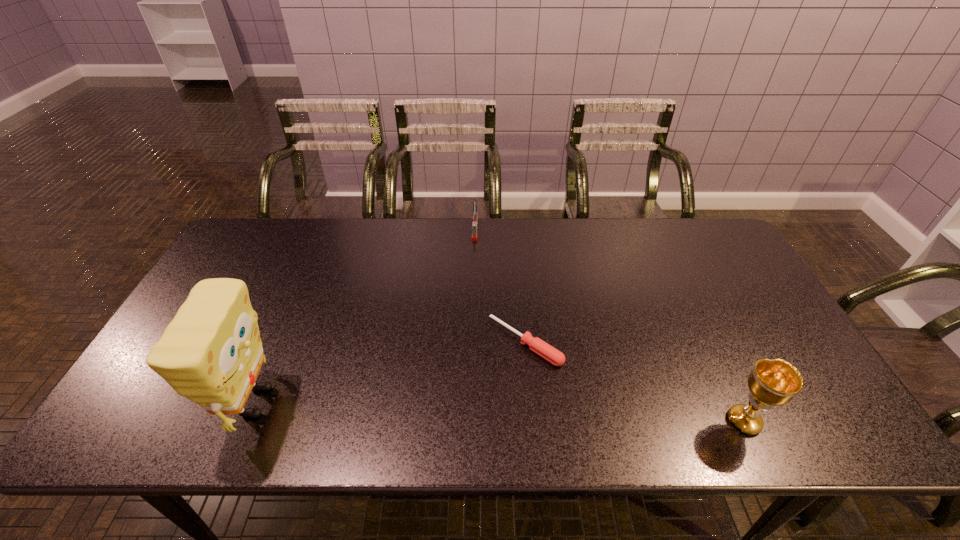
Where is `free region located on the handle side of the stapler`? The height and width of the screenshot is (540, 960). free region located on the handle side of the stapler is located at coordinates (470, 309).

Find the location of a particular element. Image resolution: width=960 pixels, height=540 pixels. vacant space situated on the handle side of the stapler is located at coordinates [x=473, y=260].

Where is `free point located on the handle side of the stapler`? This screenshot has height=540, width=960. free point located on the handle side of the stapler is located at coordinates (471, 296).

Where is `blank space located at the tip of the third object from left to right`? blank space located at the tip of the third object from left to right is located at coordinates (466, 399).

The width and height of the screenshot is (960, 540). Find the location of `vacant space located 0.160m at the tip of the third object from left to right`. vacant space located 0.160m at the tip of the third object from left to right is located at coordinates (460, 404).

At what (x,y) coordinates should I click in order to perform the action: click on object that is at the far edge. Please return your answer as a coordinate pair (x, y). Image resolution: width=960 pixels, height=540 pixels. Looking at the image, I should click on (475, 214).

Where is `sponge located in the near edge section of the desktop`? Image resolution: width=960 pixels, height=540 pixels. sponge located in the near edge section of the desktop is located at coordinates (211, 353).

The image size is (960, 540). What are the coordinates of `chalice that is at the near edge` in the screenshot? It's located at (775, 382).

The image size is (960, 540). What are the coordinates of `free space at the far edge of the desktop` in the screenshot? It's located at (320, 221).

Find the location of a particular element. The width and height of the screenshot is (960, 540). vacant space at the near edge is located at coordinates [x=473, y=390].